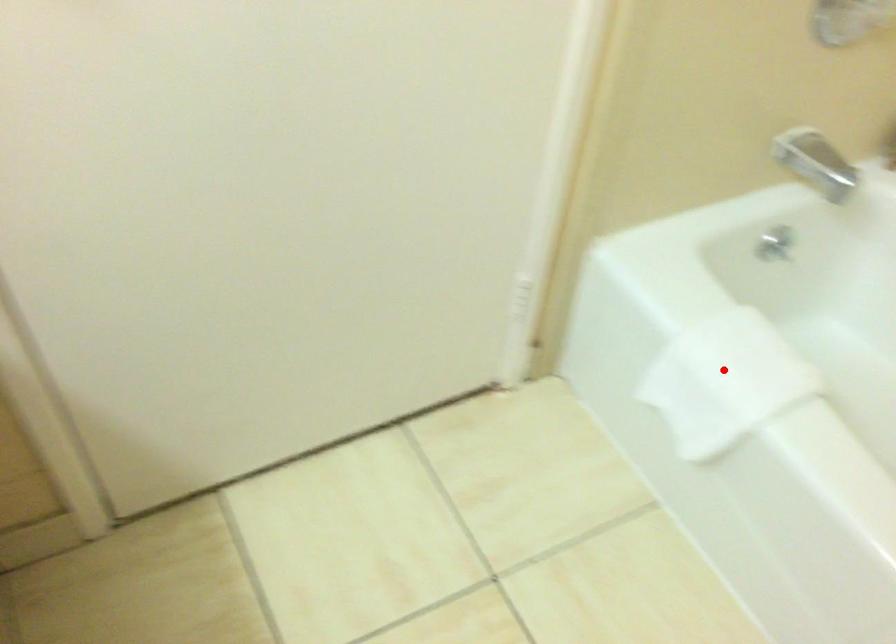
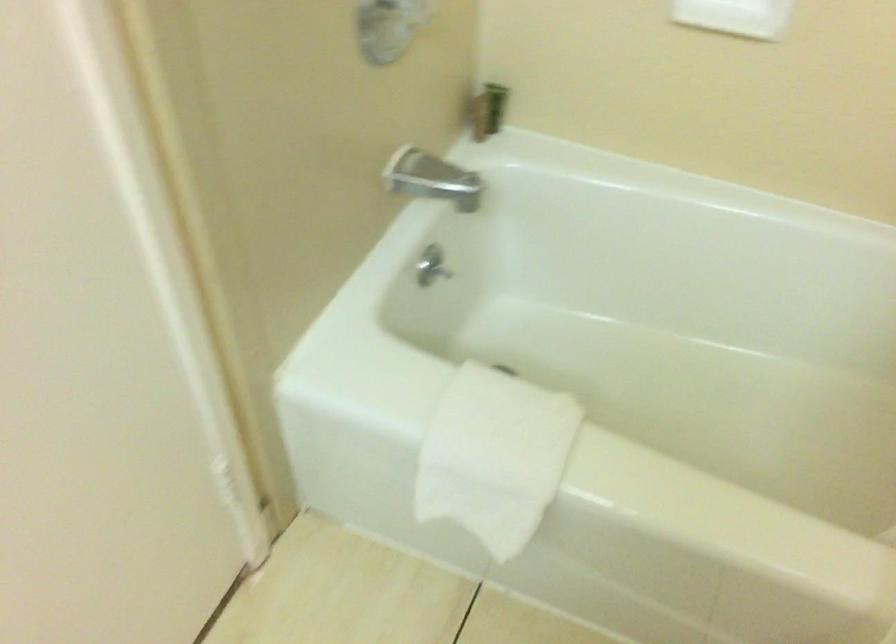
Locate, in the second image, the point that corresponds to the highlighted location in the first image.

(494, 456)